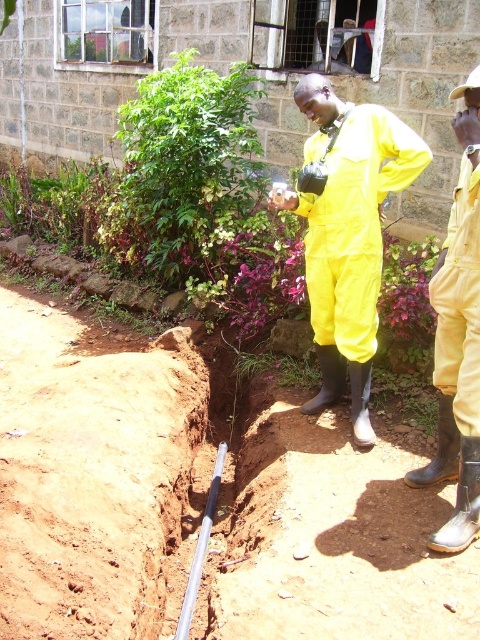
Based on the photo, you are a safety inspector at the construction site. You see the yellow rubber suit at center and the yellow rubber boots at lower right. Which object is positioned to the right side of the other?

The yellow rubber suit at center is to the left of yellow rubber boots at lower right, so the yellow rubber boots at lower right is positioned to the right side of the yellow rubber suit at center.